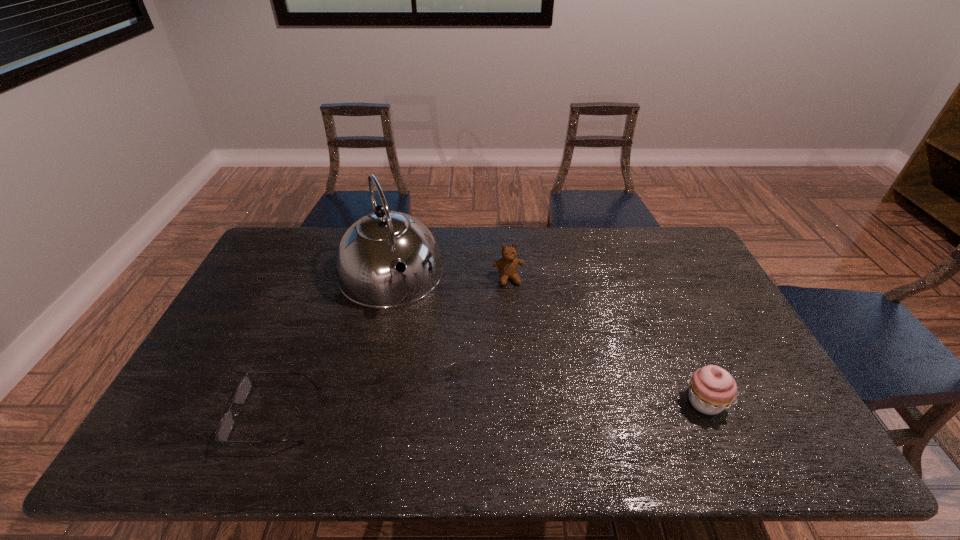
Locate an element on the screen. free space that is in between the spectacles and the kettle is located at coordinates (333, 345).

Identify the location of vacant area that lies between the tallest object and the second object from right to left. The width and height of the screenshot is (960, 540). (449, 276).

Locate an element on the screen. Image resolution: width=960 pixels, height=540 pixels. free space between the teddy bear and the shortest object is located at coordinates (392, 347).

Find the location of a particular element. vacant area that lies between the cupcake and the kettle is located at coordinates (547, 338).

Locate an element on the screen. Image resolution: width=960 pixels, height=540 pixels. empty location between the second object from right to left and the rightmost object is located at coordinates (607, 340).

Where is `object that ranks as the third closest to the spectacles`? object that ranks as the third closest to the spectacles is located at coordinates (712, 389).

Locate which object ranks in proximity to the rightmost object. Please provide its 2D coordinates. Your answer should be formatted as a tuple, i.e. [(x, y)], where the tuple contains the x and y coordinates of a point satisfying the conditions above.

[(507, 266)]